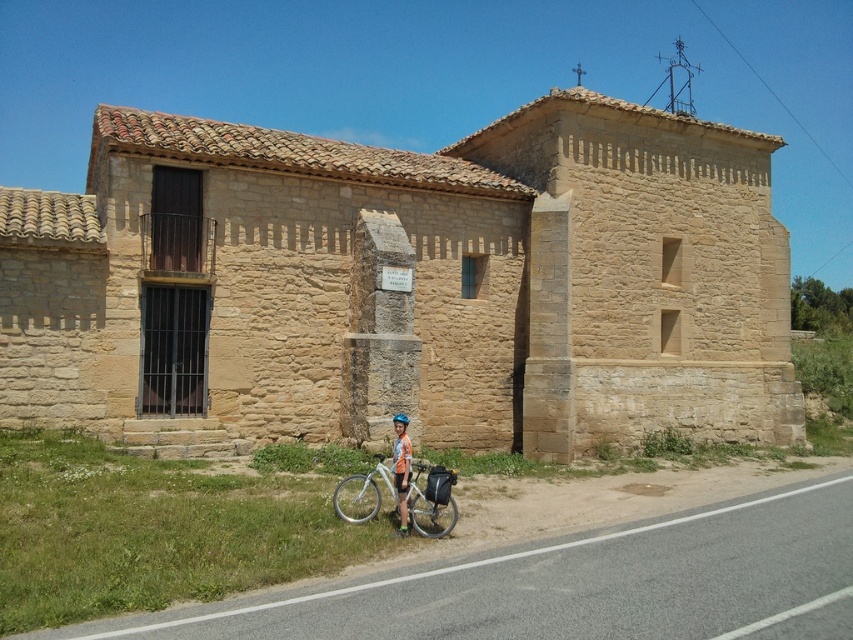
Which of these two, orange fabric shorts at lower center or white matte bicycle helmet at center, stands taller?

With more height is orange fabric shorts at lower center.

Is orange fabric shorts at lower center above white matte bicycle helmet at center?

No.

The width and height of the screenshot is (853, 640). Identify the location of orange fabric shorts at lower center. (401, 468).

Between white matte bicycle at lower center and orange fabric shorts at lower center, which one appears on the left side from the viewer's perspective?

Positioned to the left is white matte bicycle at lower center.

Can you confirm if white matte bicycle at lower center is positioned to the right of orange fabric shorts at lower center?

No, white matte bicycle at lower center is not to the right of orange fabric shorts at lower center.

Is point (444, 524) farther from viewer compared to point (404, 536)?

Yes, point (444, 524) is behind point (404, 536).

This screenshot has height=640, width=853. Find the location of `white matte bicycle at lower center`. white matte bicycle at lower center is located at coordinates [x=431, y=500].

Locate an element on the screen. white matte bicycle at lower center is located at coordinates (431, 500).

Who is more forward, (392, 470) or (402, 420)?

Point (402, 420) is in front.

Which is in front, point (376, 490) or point (404, 420)?

Positioned in front is point (376, 490).

This screenshot has width=853, height=640. What are the coordinates of `white matte bicycle at lower center` in the screenshot? It's located at coord(431,500).